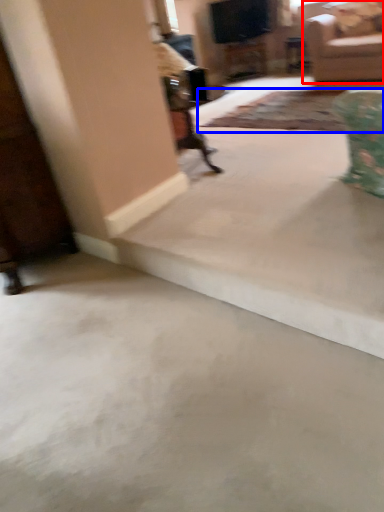
Question: Which object appears closest to the camera in this image, studio couch (highlighted by a red box) or mat (highlighted by a blue box)?

Choices:
 (A) studio couch
 (B) mat

Answer: (B)